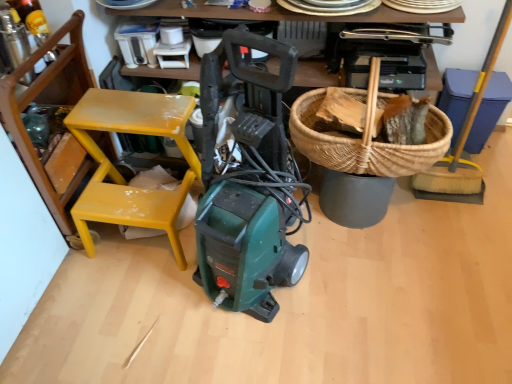
At what (x,y) coordinates should I click in order to perform the action: click on free spot above yellow painted wood chair at left (from a real-world perspective). Please return your answer as a coordinate pair (x, y). The height and width of the screenshot is (384, 512). Looking at the image, I should click on (130, 115).